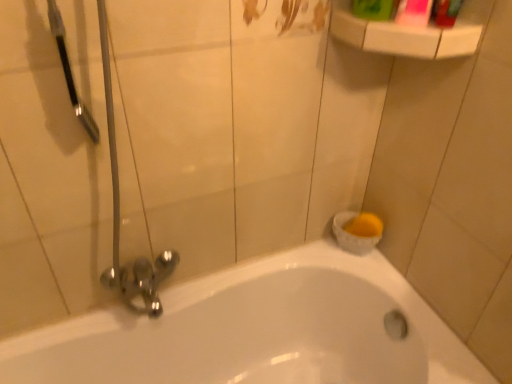
Question: Are white plastic shelf at upper right and white glossy bathtub at lower center far apart?

Choices:
 (A) yes
 (B) no

Answer: (B)

Question: Is white plastic shelf at upper right to the right of white glossy bathtub at lower center from the viewer's perspective?

Choices:
 (A) no
 (B) yes

Answer: (B)

Question: Is white plastic shelf at upper right facing towards white glossy bathtub at lower center?

Choices:
 (A) no
 (B) yes

Answer: (A)

Question: Can you see white plastic shelf at upper right touching white glossy bathtub at lower center?

Choices:
 (A) no
 (B) yes

Answer: (A)

Question: Is white plastic shelf at upper right closer to the viewer compared to white glossy bathtub at lower center?

Choices:
 (A) no
 (B) yes

Answer: (A)

Question: Does white plastic shelf at upper right have a lesser height compared to white glossy bathtub at lower center?

Choices:
 (A) yes
 (B) no

Answer: (A)

Question: From a real-world perspective, is green plastic mouthwash at upper right, arranged as the second mouthwash when viewed from the right, positioned under white glossy bathtub at lower center based on gravity?

Choices:
 (A) no
 (B) yes

Answer: (A)

Question: Can you confirm if green plastic mouthwash at upper right, arranged as the second mouthwash when viewed from the right, is smaller than white glossy bathtub at lower center?

Choices:
 (A) no
 (B) yes

Answer: (B)

Question: Is the position of green plastic mouthwash at upper right, which is counted as the first mouthwash, starting from the left, more distant than that of white glossy bathtub at lower center?

Choices:
 (A) no
 (B) yes

Answer: (B)

Question: Does green plastic mouthwash at upper right, which is counted as the first mouthwash, starting from the left, have a greater width compared to white glossy bathtub at lower center?

Choices:
 (A) yes
 (B) no

Answer: (B)

Question: From a real-world perspective, is green plastic mouthwash at upper right, arranged as the second mouthwash when viewed from the right, located higher than white glossy bathtub at lower center?

Choices:
 (A) no
 (B) yes

Answer: (B)

Question: Are green plastic mouthwash at upper right, arranged as the second mouthwash when viewed from the right, and white glossy bathtub at lower center making contact?

Choices:
 (A) no
 (B) yes

Answer: (A)

Question: Considering the relative sizes of white glossy bathtub at lower center and green plastic mouthwash at upper right, arranged as the second mouthwash when viewed from the right, in the image provided, is white glossy bathtub at lower center taller than green plastic mouthwash at upper right, arranged as the second mouthwash when viewed from the right,?

Choices:
 (A) yes
 (B) no

Answer: (A)